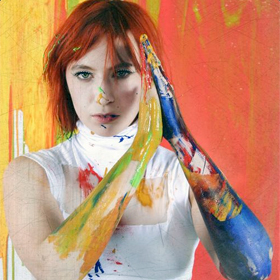
Where is `chest`? This screenshot has width=280, height=280. chest is located at coordinates (143, 208).